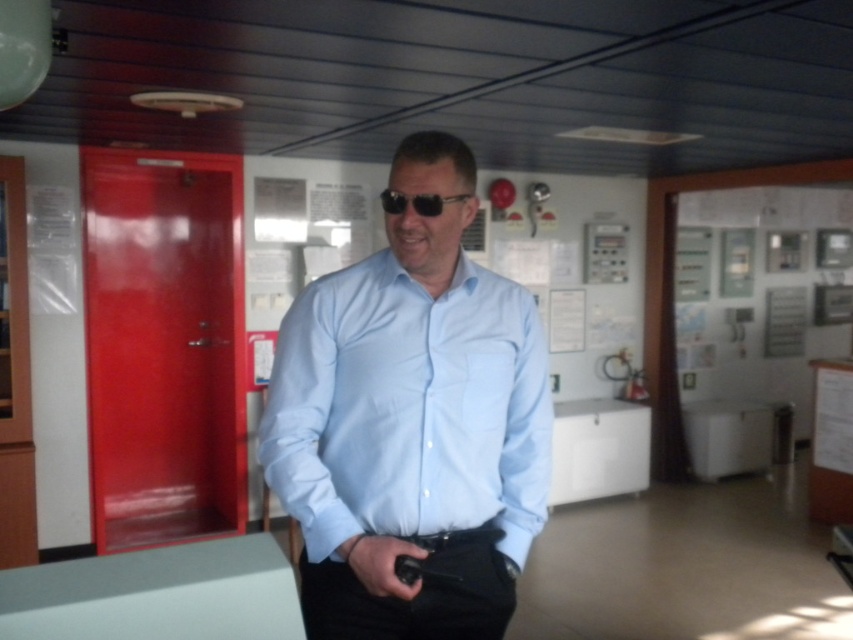
Is light blue shirt at center shorter than black matte gun at lower center?

No, light blue shirt at center is not shorter than black matte gun at lower center.

Which is behind, point (520, 545) or point (361, 579)?

Positioned behind is point (520, 545).

Is point (524, 483) positioned after point (396, 596)?

That is True.

The width and height of the screenshot is (853, 640). I want to click on light blue shirt at center, so click(412, 417).

Is light blue shirt at center positioned behind black plastic sunglasses at center?

No, it is not.

Can you confirm if light blue shirt at center is positioned to the left of black plastic sunglasses at center?

No, light blue shirt at center is not to the left of black plastic sunglasses at center.

Between point (321, 440) and point (431, 205), which one is positioned behind?

The point (321, 440) is more distant.

Where is `light blue shirt at center`? light blue shirt at center is located at coordinates (412, 417).

Does black matte gun at lower center have a lesser width compared to black plastic sunglasses at center?

Correct, black matte gun at lower center's width is less than black plastic sunglasses at center's.

Is black matte gun at lower center smaller than black plastic sunglasses at center?

Indeed, black matte gun at lower center has a smaller size compared to black plastic sunglasses at center.

Who is more forward, (369, 577) or (469, 195)?

Point (369, 577)

Locate an element on the screen. The height and width of the screenshot is (640, 853). black matte gun at lower center is located at coordinates pos(380,563).